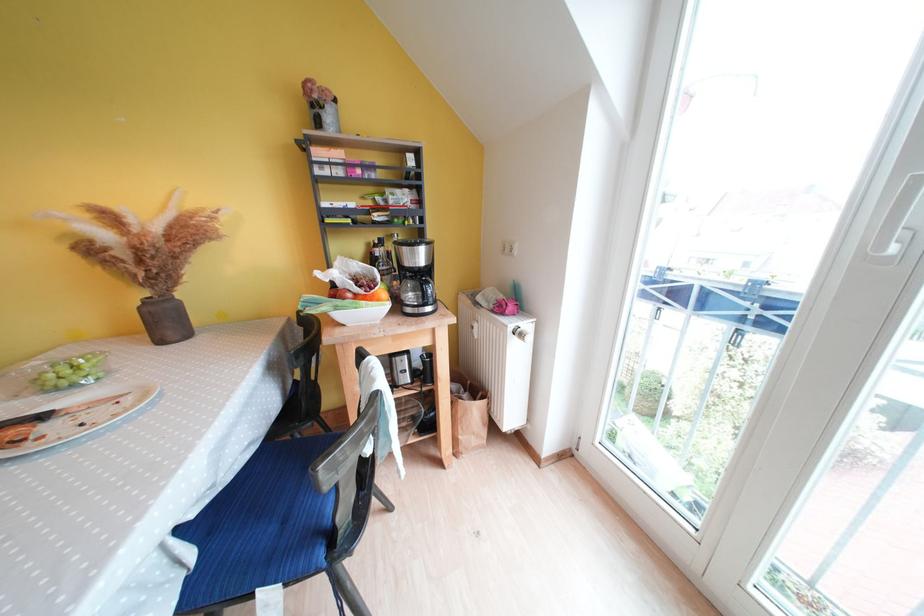
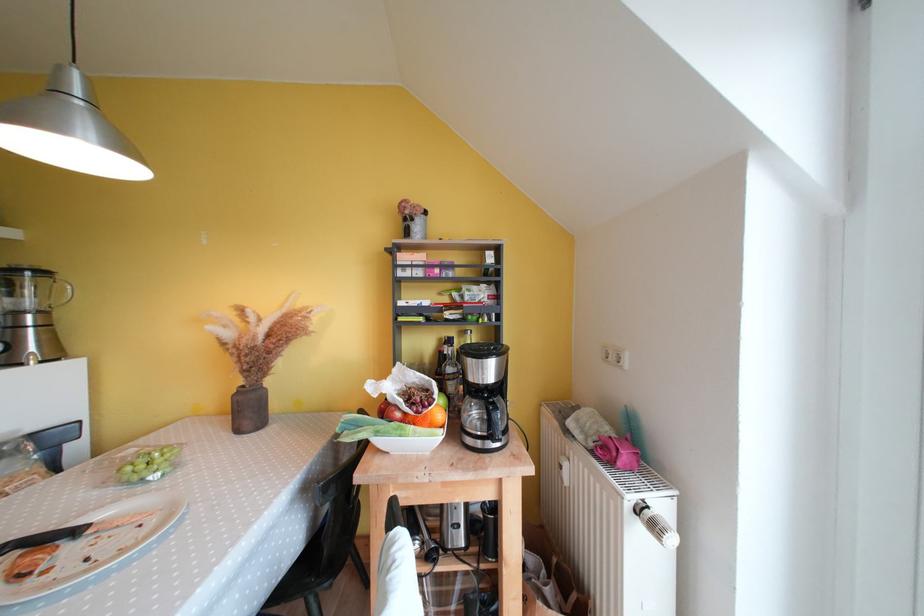
Question: What movement of the cameraman would produce the second image?

Choices:
 (A) Left
 (B) Right
 (C) Forward
 (D) Backward

Answer: (C)